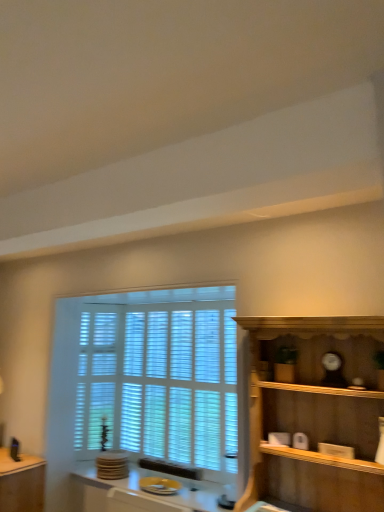
In order to face matte brown table at lower left, should I rotate leftwards or rightwards?

Turn left approximately 24.795 degrees to face it.

From the picture: In order to face white wood window at center, should I rotate leftwards or rightwards?

Rotate left and turn 9.036 degrees.

Find the location of `yellow glossy plate at lower center`. yellow glossy plate at lower center is located at coordinates (142, 493).

Locate an element on the screen. wooden shelf at right is located at coordinates (315, 415).

Where is `matte brown table at lower left`? The width and height of the screenshot is (384, 512). matte brown table at lower left is located at coordinates (21, 483).

Which point is more forward, [356,490] or [41,476]?

The point [356,490] is closer to the camera.

Between wooden shelf at right and matte brown table at lower left, which one is positioned behind?

Positioned behind is matte brown table at lower left.

How different are the orientations of wooden shelf at right and matte brown table at lower left in degrees?

The angular difference between wooden shelf at right and matte brown table at lower left is 0.85 degrees.

From the picture: Can you see wooden shelf at right touching matte brown table at lower left?

No.

From the image's perspective, which is above, wooden shelf at right or yellow glossy plate at lower center?

wooden shelf at right, from the image's perspective.

Which is in front, wooden shelf at right or yellow glossy plate at lower center?

wooden shelf at right is more forward.

The image size is (384, 512). What are the coordinates of `shelf that is in front of the yellow glossy plate at lower center` in the screenshot? It's located at (315, 415).

Is wooden shelf at right smaller than yellow glossy plate at lower center?

Actually, wooden shelf at right might be larger than yellow glossy plate at lower center.

Is white wood window at center further to camera compared to yellow glossy plate at lower center?

No, white wood window at center is closer to the viewer.

From a real-world perspective, between white wood window at center and yellow glossy plate at lower center, who is vertically higher?

white wood window at center.

Considering the sizes of white wood window at center and yellow glossy plate at lower center in the image, is white wood window at center bigger or smaller than yellow glossy plate at lower center?

white wood window at center is bigger than yellow glossy plate at lower center.

Considering the sizes of objects white wood window at center and yellow glossy plate at lower center in the image provided, who is taller, white wood window at center or yellow glossy plate at lower center?

white wood window at center is taller.

Can you confirm if white wood window at center is wider than wooden shelf at right?

Incorrect, the width of white wood window at center does not surpass that of wooden shelf at right.

Image resolution: width=384 pixels, height=512 pixels. I want to click on window that appears below the wooden shelf at right (from a real-world perspective), so click(x=150, y=380).

How distant is white wood window at center from wooden shelf at right?

white wood window at center is 1.23 meters from wooden shelf at right.

Is white wood window at center facing towards wooden shelf at right?

No, white wood window at center is not oriented towards wooden shelf at right.

How distant is matte brown table at lower left from white wood window at center?

matte brown table at lower left and white wood window at center are 36.40 inches apart from each other.

From a real-world perspective, between matte brown table at lower left and white wood window at center, who is vertically lower?

matte brown table at lower left, from a real-world perspective.

From the image's perspective, is matte brown table at lower left located beneath white wood window at center?

Indeed, from the image's perspective, matte brown table at lower left is shown beneath white wood window at center.

In terms of width, does matte brown table at lower left look wider or thinner when compared to white wood window at center?

Clearly, matte brown table at lower left has more width compared to white wood window at center.

In the scene shown: Considering the relative positions of yellow glossy plate at lower center and wooden shelf at right in the image provided, is yellow glossy plate at lower center in front of wooden shelf at right?

No, the depth of yellow glossy plate at lower center is greater than that of wooden shelf at right.

Between yellow glossy plate at lower center and wooden shelf at right, which one has smaller width?

With smaller width is wooden shelf at right.

Could you tell me if yellow glossy plate at lower center is facing wooden shelf at right?

No, yellow glossy plate at lower center is not oriented towards wooden shelf at right.

Locate an element on the screen. Image resolution: width=384 pixels, height=512 pixels. vanity that appears below the wooden shelf at right (from a real-world perspective) is located at coordinates (142, 493).

Between wooden shelf at right and white wood window at center, which one has more height?

white wood window at center is taller.

Does wooden shelf at right turn towards white wood window at center?

No, wooden shelf at right is not oriented towards white wood window at center.

Is white wood window at center surrounded by wooden shelf at right?

No, wooden shelf at right does not contain white wood window at center.

Where is `table that appears on the left of wooden shelf at right`? The width and height of the screenshot is (384, 512). table that appears on the left of wooden shelf at right is located at coordinates (21, 483).

Identify the location of shelf in front of the yellow glossy plate at lower center. Image resolution: width=384 pixels, height=512 pixels. (315, 415).

From the image, which object appears to be farther from matte brown table at lower left, wooden shelf at right or white wood window at center?

The object further to matte brown table at lower left is wooden shelf at right.

Looking at the image, which one is located further to wooden shelf at right, white wood window at center or matte brown table at lower left?

matte brown table at lower left lies further to wooden shelf at right than the other object.

When comparing their distances from yellow glossy plate at lower center, does white wood window at center or matte brown table at lower left seem closer?

matte brown table at lower left is positioned closer to the anchor yellow glossy plate at lower center.

Considering their positions, is matte brown table at lower left positioned further to yellow glossy plate at lower center than wooden shelf at right?

wooden shelf at right is positioned further to the anchor yellow glossy plate at lower center.

When comparing their distances from wooden shelf at right, does white wood window at center or yellow glossy plate at lower center seem closer?

Based on the image, white wood window at center appears to be nearer to wooden shelf at right.

When comparing their distances from matte brown table at lower left, does white wood window at center or yellow glossy plate at lower center seem further?

Based on the image, white wood window at center appears to be further to matte brown table at lower left.

Looking at the image, which one is located further to matte brown table at lower left, white wood window at center or wooden shelf at right?

wooden shelf at right.

Estimate the real-world distances between objects in this image. Which object is further from yellow glossy plate at lower center, wooden shelf at right or matte brown table at lower left?

wooden shelf at right lies further to yellow glossy plate at lower center than the other object.

At what (x,y) coordinates should I click in order to perform the action: click on vanity between matte brown table at lower left and wooden shelf at right. Please return your answer as a coordinate pair (x, y). The image size is (384, 512). Looking at the image, I should click on (142, 493).

This screenshot has width=384, height=512. Identify the location of window between wooden shelf at right and yellow glossy plate at lower center in the front-back direction. (150, 380).

I want to click on window between matte brown table at lower left and yellow glossy plate at lower center in the horizontal direction, so click(x=150, y=380).

Find the location of `window between matte brown table at lower left and wooden shelf at right from left to right`. window between matte brown table at lower left and wooden shelf at right from left to right is located at coordinates (150, 380).